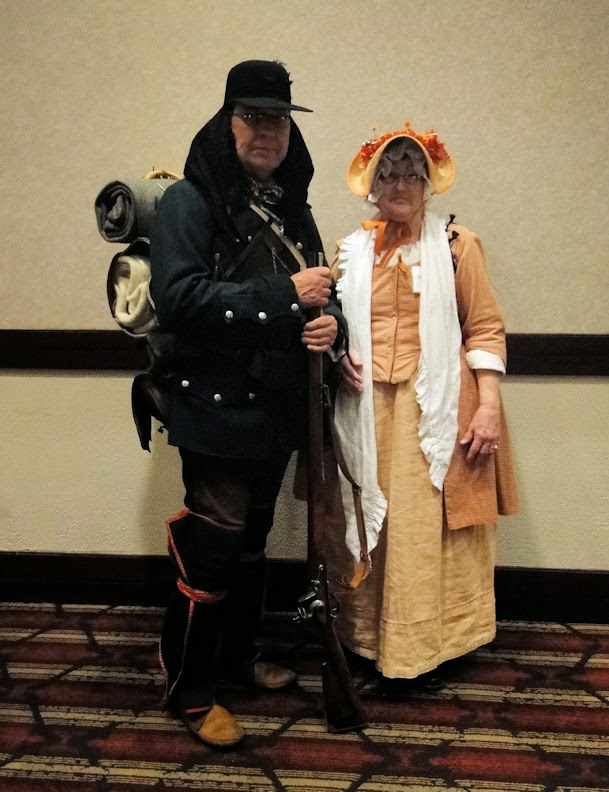
Identify the location of rolled blankets. (138, 208), (142, 303).